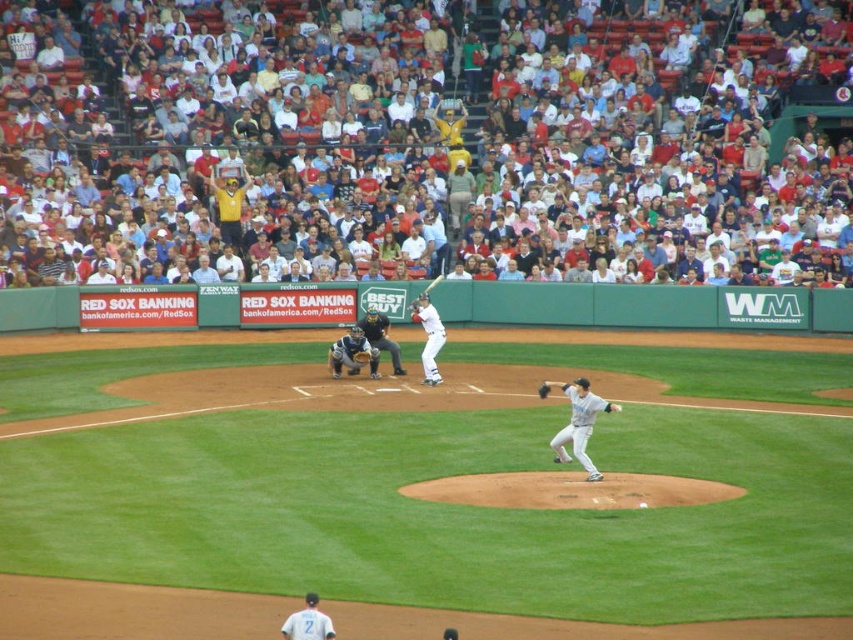
Question: Which object appears farthest from the camera in this image?

Choices:
 (A) white matte baseball bat at center
 (B) white jersey at center
 (C) white cotton crowd at upper center
 (D) dark brown leather glove at center

Answer: (C)

Question: Is yellow jersey at upper center closer to camera compared to white uniform catcher at center?

Choices:
 (A) no
 (B) yes

Answer: (A)

Question: Can you confirm if dark brown leather glove at center is positioned below brown leather baseball glove at center?

Choices:
 (A) no
 (B) yes

Answer: (A)

Question: Which of the following is the farthest from the observer?

Choices:
 (A) (442, 275)
 (B) (241, 234)

Answer: (A)

Question: From the image, what is the correct spatial relationship of blue leather catcher at center in relation to white jersey at center?

Choices:
 (A) below
 (B) above

Answer: (B)

Question: Which of the following is the farthest from the observer?

Choices:
 (A) white jersey at center
 (B) white cotton crowd at upper center
 (C) brown leather baseball glove at center

Answer: (B)